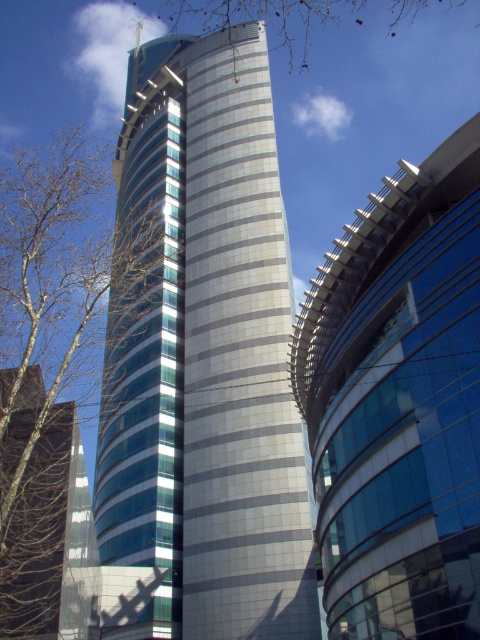
You are a drone operator who needs to fly a drone between the two buildings. The drone has a maximum flight height of 200 meters. Given that the silver metallic tower at center is taller than the glassy reflective building at center, can you safely fly the drone between them without exceeding its height limit?

The silver metallic tower at center is taller than the glassy reflective building at center. Since the drone has a maximum flight height of 200 meters, you can safely fly it between them as long as the height of the shorter building, the glassy reflective building at center, is below 200 meters. However, without knowing the exact height of the glassy reflective building at center, it is impossible to confirm if the drone can safely fly between them without exceeding its height limit.

You are a drone operator trying to capture aerial footage of the silver metallic tower at center and the bare branches at left. Which object should you adjust your camera angle to focus on first if you want to ensure both are in frame without moving the drone?

The silver metallic tower at center is shorter than the bare branches at left, so you should focus on the bare branches at left first to ensure the shorter tower remains in frame.

You are standing at the origin point of the coordinate system in the image. Which direction should you move to reach the glassy reflective building at center?

Since the glassy reflective building at center is located at coordinate point 0.633 on the x axis and 0.831 on the y axis, you should move towards the right and upwards to reach it from the origin point.